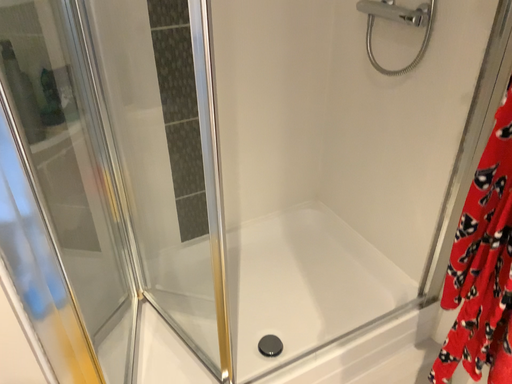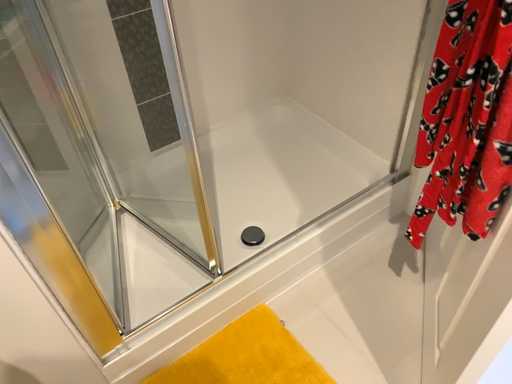
Question: Which way did the camera rotate in the video?

Choices:
 (A) rotated upward
 (B) rotated downward

Answer: (B)